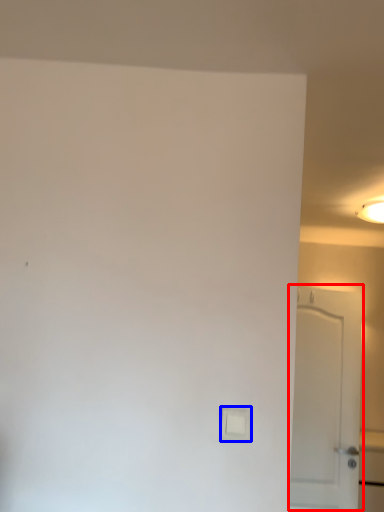
Question: Among these objects, which one is farthest to the camera, door (highlighted by a red box) or light switch (highlighted by a blue box)?

Choices:
 (A) door
 (B) light switch

Answer: (A)